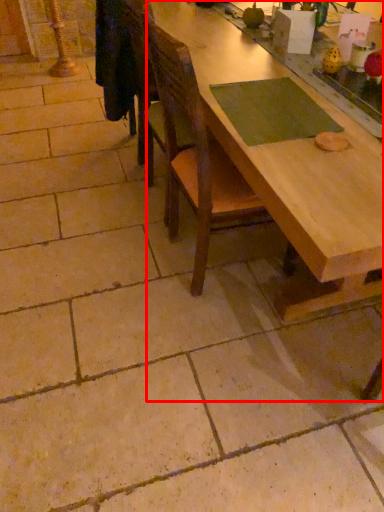
Question: Considering the relative positions of table (annotated by the red box) and chair in the image provided, where is table (annotated by the red box) located with respect to the staircase?

Choices:
 (A) right
 (B) left

Answer: (A)